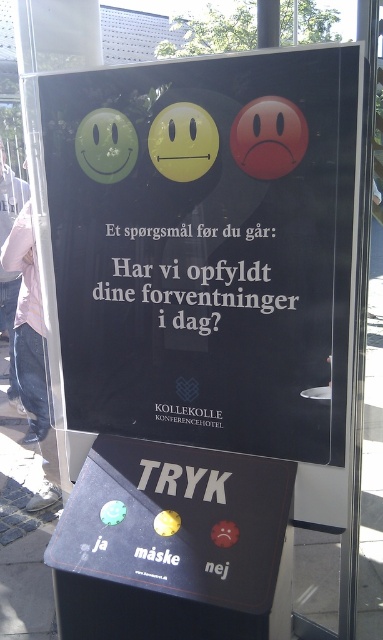
You are a hotel guest who wants to provide feedback on your stay. You see the black glossy poster at center and the rubberized plastic buttons at center. Which object should you interact with to give your feedback?

The rubberized plastic buttons at center should be interacted with to give feedback because the black glossy poster at center is larger and likely serves as a static display, while the buttons are the interactive elements for input.

You are standing in front of the customer satisfaction survey kiosk at Kollekolle Konferencehotel. You need to press the point at position (98, 321) to submit your response. If your arm can reach 1.5 meters, can you reach that point?

The distance of point (98, 321) is 1.56 meters from the viewer. Since your arm can reach 1.5 meters, you cannot reach that point as it is slightly further away than your arm length.

You are a conference attendee at Kollekolle Konferencehotel and want to complete the customer survey. You see the black glossy poster at center and the rubberized plastic buttons at center. Which object is taller?

The black glossy poster at center is much taller than the rubberized plastic buttons at center.